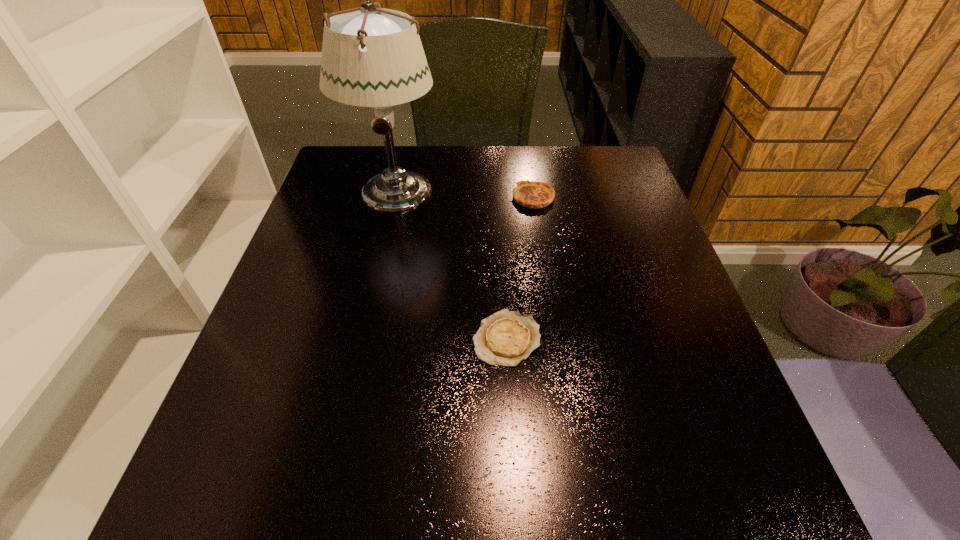
The width and height of the screenshot is (960, 540). In order to click on free location that satisfies the following two spatial constraints: 1. on the lampshade of the leftmost object; 2. on the left side of the second tallest object in this screenshot , I will do `click(394, 198)`.

You are a GUI agent. You are given a task and a screenshot of the screen. Output one action in this format:
    pyautogui.click(x=<x>, y=<y>)
    Task: Click on the free point that satisfies the following two spatial constraints: 1. on the lampshade of the second tallest object; 2. on the left side of the tallest object
    The height and width of the screenshot is (540, 960).
    Given the screenshot: What is the action you would take?
    pyautogui.click(x=394, y=198)

This screenshot has height=540, width=960. I want to click on free point that satisfies the following two spatial constraints: 1. on the back side of the nearest object; 2. on the left side of the second shortest object, so click(499, 198).

This screenshot has height=540, width=960. What are the coordinates of `vacant region that satisfies the following two spatial constraints: 1. on the lampshade of the leftmost object; 2. on the left side of the farther quiche` in the screenshot? It's located at (394, 198).

The image size is (960, 540). Identify the location of free space that satisfies the following two spatial constraints: 1. on the lampshade of the lampshade; 2. on the left side of the shortest object. (361, 338).

Find the location of a particular element. free space that satisfies the following two spatial constraints: 1. on the lampshade of the lampshade; 2. on the left side of the farther quiche is located at coordinates (394, 198).

You are a GUI agent. You are given a task and a screenshot of the screen. Output one action in this format:
    pyautogui.click(x=<x>, y=<y>)
    Task: Click on the vacant space that satisfies the following two spatial constraints: 1. on the lampshade of the lampshade; 2. on the right side of the taller quiche
    The width and height of the screenshot is (960, 540).
    Given the screenshot: What is the action you would take?
    pyautogui.click(x=394, y=198)

This screenshot has width=960, height=540. I want to click on vacant position in the image that satisfies the following two spatial constraints: 1. on the lampshade of the tallest object; 2. on the left side of the nearer quiche, so click(361, 338).

Locate an element on the screen. The image size is (960, 540). free spot that satisfies the following two spatial constraints: 1. on the lampshade of the shorter quiche; 2. on the left side of the tallest object is located at coordinates tap(361, 338).